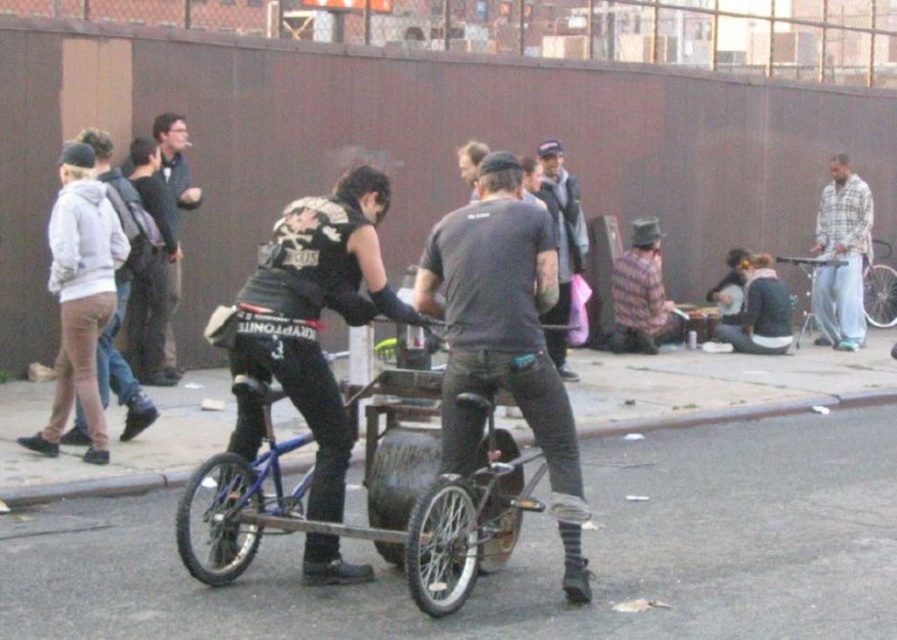
You are a delivery driver who needs to place a package on the smooth asphalt road at center and the blue metallic bicycle at right. Which surface can you place the package on without it rolling off?

The smooth asphalt road at center has a lesser height compared to blue metallic bicycle at right, so the package can be placed on the blue metallic bicycle at right to prevent it from rolling off.

From the picture: You are a pedestrian walking on the sidewalk and see the plaid flannel shirt at right and the blue metallic bicycle at right. Which object is closer to the sidewalk?

The plaid flannel shirt at right is positioned on the left side of blue metallic bicycle at right, so the plaid flasl shirt at right is closer to the sidewalk.